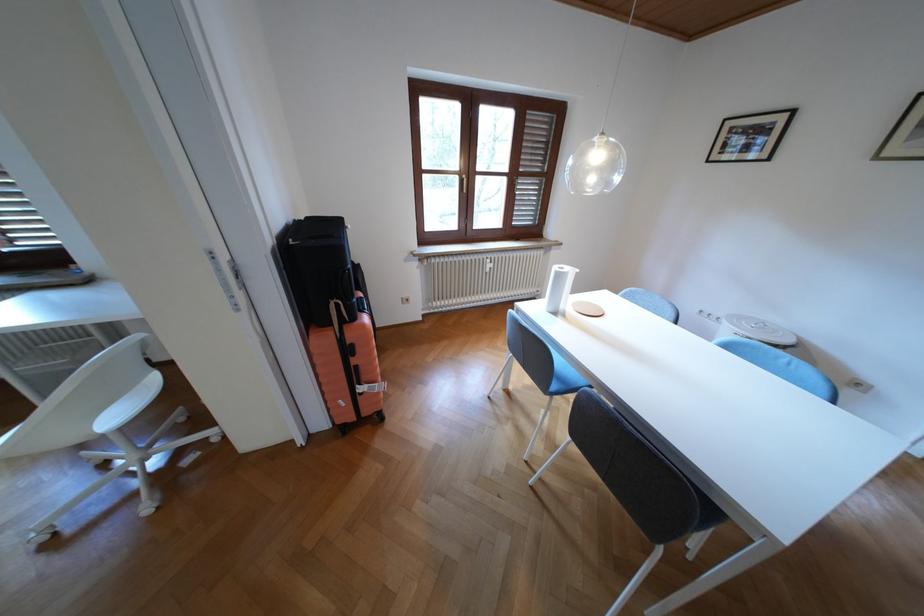
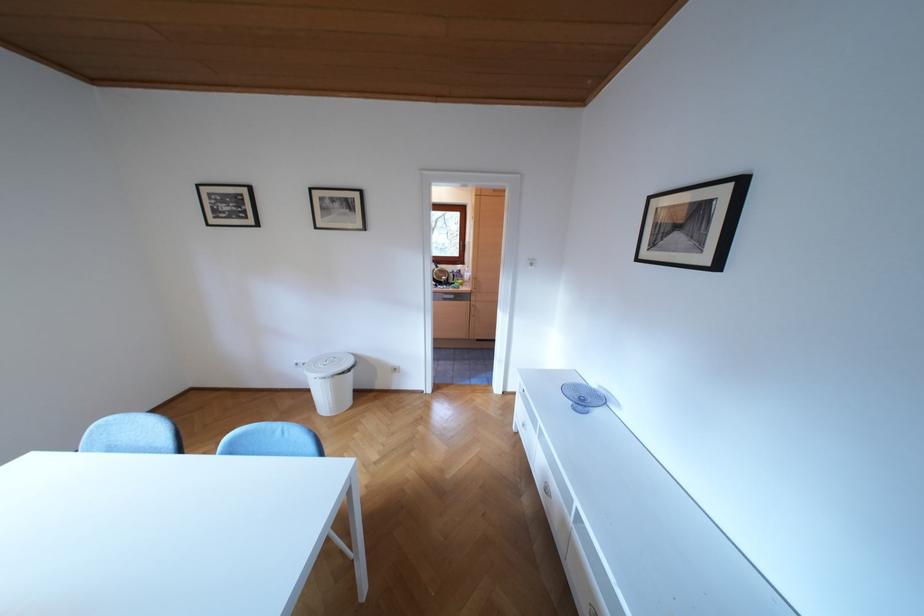
Question: The camera is either moving clockwise (left) or counter-clockwise (right) around the object. The first image is from the beginning of the video and the second image is from the end. Is the camera moving left or right when shooting the video?

Choices:
 (A) Left
 (B) Right

Answer: (A)